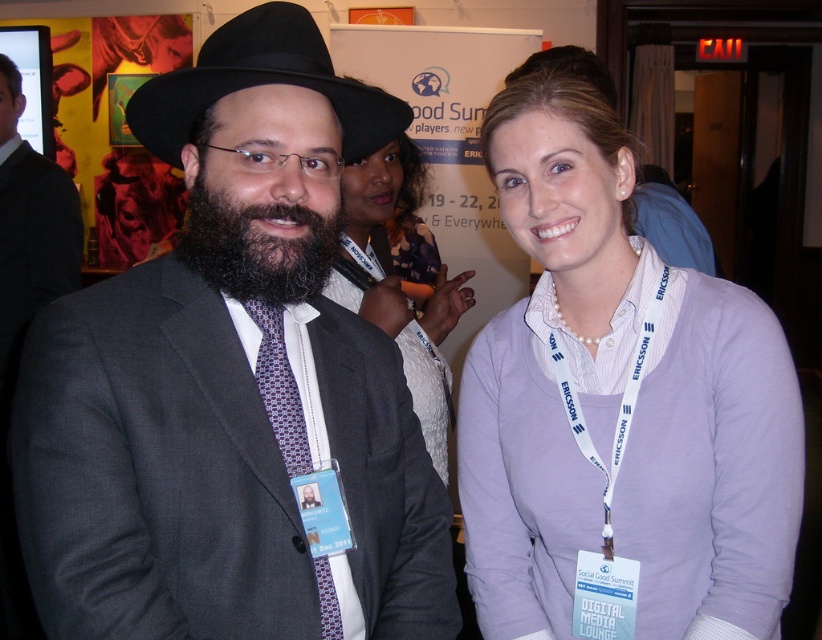
Is dark brown fuzzy beard at center above patterned silk tie at center?

Correct, dark brown fuzzy beard at center is located above patterned silk tie at center.

Does dark brown fuzzy beard at center have a lesser height compared to patterned silk tie at center?

Indeed, dark brown fuzzy beard at center has a lesser height compared to patterned silk tie at center.

Locate an element on the screen. dark brown fuzzy beard at center is located at coordinates (256, 248).

Between matte gray suit at center and patterned silk tie at center, which one is positioned higher?

Positioned higher is matte gray suit at center.

Which is more to the left, matte gray suit at center or patterned silk tie at center?

From the viewer's perspective, matte gray suit at center appears more on the left side.

At what (x,y) coordinates should I click in order to perform the action: click on matte gray suit at center. Please return your answer as a coordinate pair (x, y). This screenshot has height=640, width=822. Looking at the image, I should click on (231, 384).

Where is `matte gray suit at center`? matte gray suit at center is located at coordinates (231, 384).

Based on the photo, who is lower down, matte white shirt at center or dark brown fuzzy beard at center?

matte white shirt at center is lower down.

In order to click on matte white shirt at center in this screenshot , I will do pos(396,292).

The height and width of the screenshot is (640, 822). I want to click on matte white shirt at center, so click(x=396, y=292).